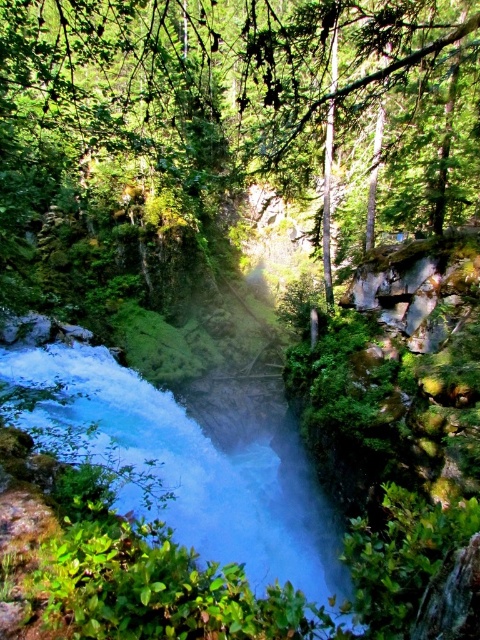
Question: Which point appears farthest from the camera in this image?

Choices:
 (A) (85, 369)
 (B) (199, 115)

Answer: (B)

Question: Is green leafy tree at center above white frothy water at center?

Choices:
 (A) yes
 (B) no

Answer: (A)

Question: Which of the following is the closest to the observer?

Choices:
 (A) white frothy water at center
 (B) green leafy tree at center

Answer: (A)

Question: Can you confirm if green leafy tree at center is positioned to the left of white frothy water at center?

Choices:
 (A) yes
 (B) no

Answer: (A)

Question: Can you confirm if green leafy tree at center is positioned to the right of white frothy water at center?

Choices:
 (A) no
 (B) yes

Answer: (A)